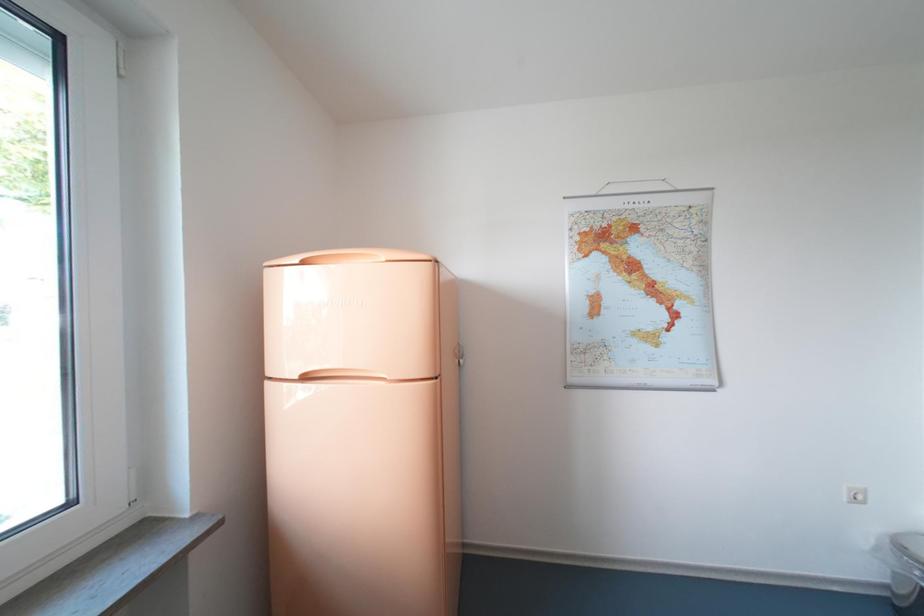
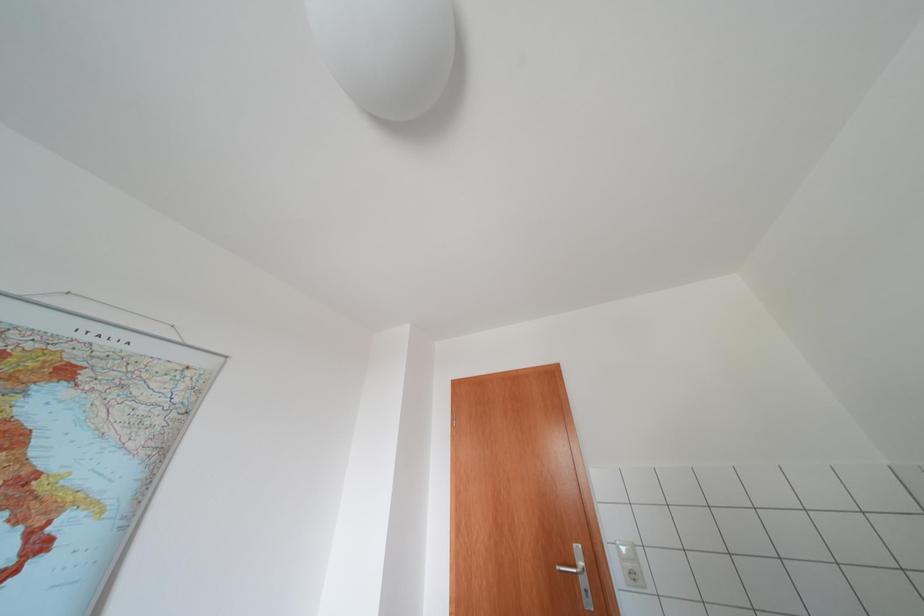
Based on the photo, the images are taken continuously from a first-person perspective. In which direction is your viewpoint rotating?

The camera's rotation is toward right-up.